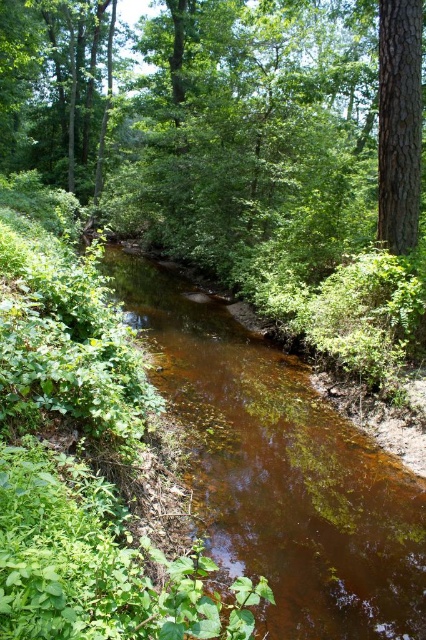
You are a hiker who wants to cross the stream. You see the brown translucent water at center and the smooth brown tree trunk at upper right. Which object is higher up in the image?

The smooth brown tree trunk at upper right is higher up in the image than the brown translucent water at center.

You are standing at the edge of the stream and want to throw a small pebble into the brown translucent water at center. Considering your arm length is 0.7 meters, can you reach the water without moving your feet?

The brown translucent water at center is 3.72 meters away from viewer. Since your arm length is only 0.7 meters, you cannot reach the water without moving your feet.

You are standing at the edge of the forest and see the brown translucent water at center and the smooth brown tree trunk at upper right. Which object is positioned to the left when viewed from your perspective?

The brown translucent water at center is positioned to the left of the smooth brown tree trunk at upper right.